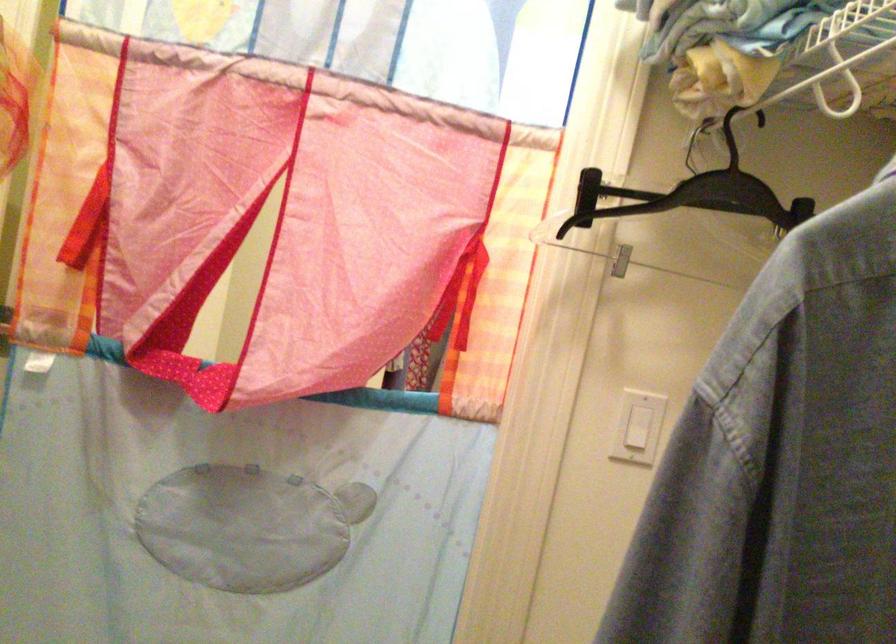
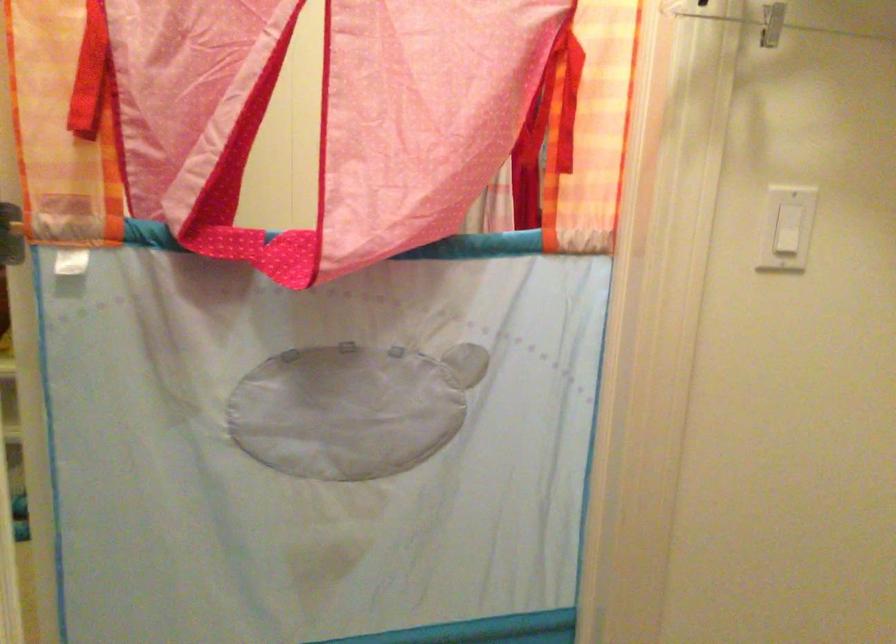
What movement of the cameraman would produce the second image?

The movement direction of the cameraman is left, forward.